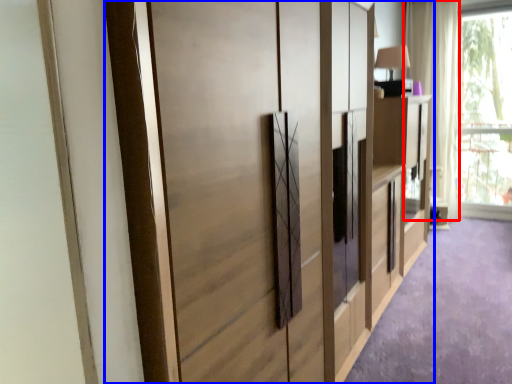
Question: Which object appears closest to the camera in this image, curtain (highlighted by a red box) or cupboard (highlighted by a blue box)?

Choices:
 (A) curtain
 (B) cupboard

Answer: (B)